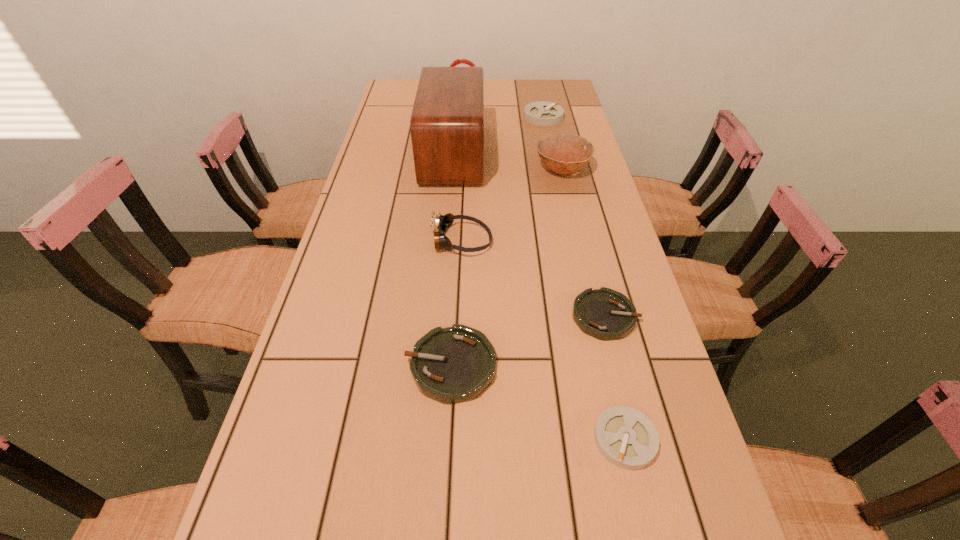
The image size is (960, 540). In order to click on vacant region between the tallest object and the smaller green ashtray in this screenshot , I will do 529,235.

I want to click on vacant area that lies between the red watch and the right green ashtray, so click(x=534, y=202).

This screenshot has width=960, height=540. I want to click on free spot between the bronze goggles and the farther gray ashtray, so click(x=502, y=179).

Select which object is the fifth closest to the bowl. Please provide its 2D coordinates. Your answer should be formatted as a tuple, i.e. [(x, y)], where the tuple contains the x and y coordinates of a point satisfying the conditions above.

[(457, 61)]

Locate an element on the screen. This screenshot has width=960, height=540. the sixth closest object to the fourth shortest object is located at coordinates (451, 365).

Identify which ashtray is the third nearest to the nearest ashtray. Please provide its 2D coordinates. Your answer should be formatted as a tuple, i.e. [(x, y)], where the tuple contains the x and y coordinates of a point satisfying the conditions above.

[(541, 113)]

Select which ashtray appears as the closest to the sixth shortest object. Please provide its 2D coordinates. Your answer should be formatted as a tuple, i.e. [(x, y)], where the tuple contains the x and y coordinates of a point satisfying the conditions above.

[(541, 113)]

The image size is (960, 540). What are the coordinates of `green ashtray identified as the closest to the goggles` in the screenshot? It's located at (605, 314).

Identify which green ashtray is the closest to the farthest ashtray. Please provide its 2D coordinates. Your answer should be formatted as a tuple, i.e. [(x, y)], where the tuple contains the x and y coordinates of a point satisfying the conditions above.

[(605, 314)]

At what (x,y) coordinates should I click in order to perform the action: click on vacant position in the image that satisfies the following two spatial constraints: 1. on the face of the smaller gray ashtray; 2. on the left side of the watch. Please return your answer as a coordinate pair (x, y). Looking at the image, I should click on (441, 439).